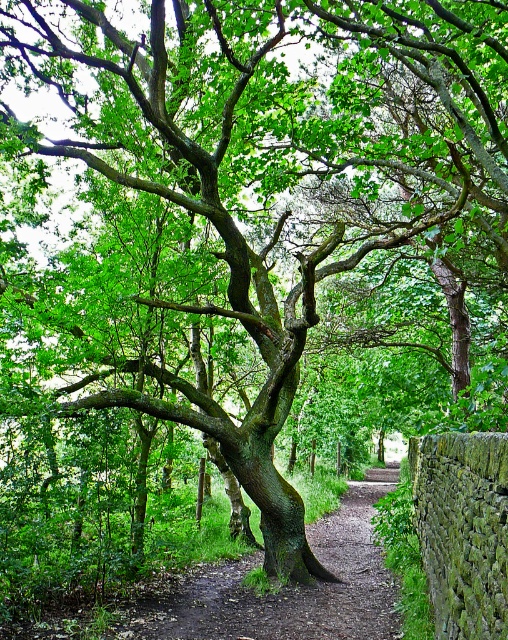
You are a hiker who wants to walk along the dirt path at center and the green mossy stone wall at lower right. Which one is wider so you can walk comfortably?

The dirt path at center is bigger than the green mossy stone wall at lower right, so you can walk comfortably along the dirt path at center.

You are a hiker standing at the edge of the dirt path at center in the woodland scene. You want to walk towards the green mossy stone wall at lower right. Which direction should you move to get closer to the wall?

The dirt path at center is further to the viewer than the green mossy stone wall at lower right, so to move closer to the wall, you should walk forward along the path towards the wall.

You are standing at the point with coordinates (285, 588) in the woodland scene. What is located exactly at this point?

The dirt path at center is located at point (285, 588).